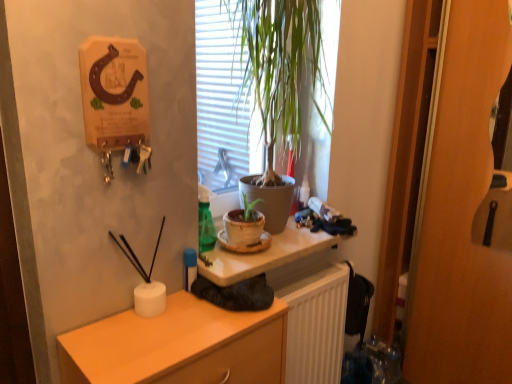
Locate an element on the screen. Image resolution: width=512 pixels, height=384 pixels. empty space that is ontop of matte orange cabinet at lower left (from a real-world perspective) is located at coordinates (170, 325).